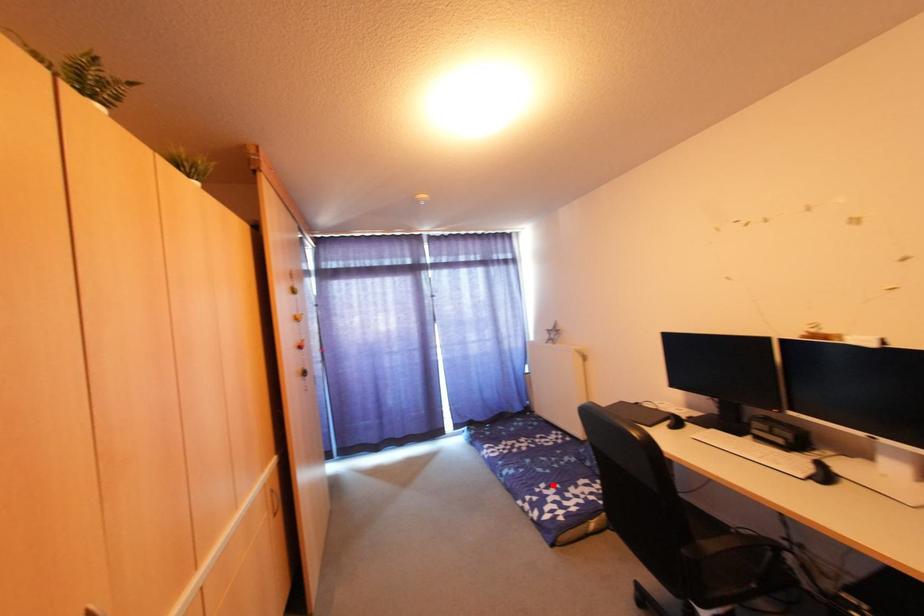
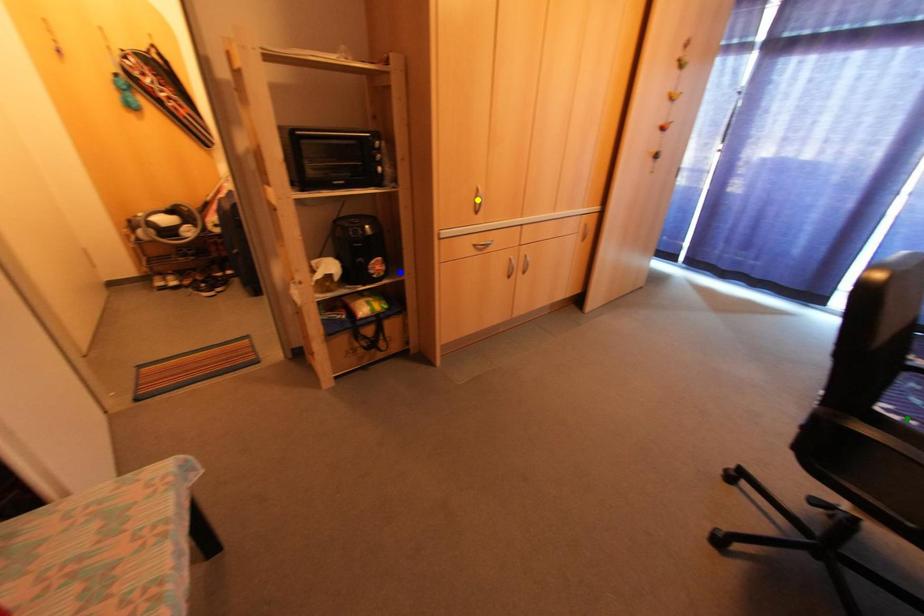
Question: I am providing you with two images of the same scene from different viewpoints. A red point is marked on the first image. You are given multiple points on the second image. Which point in image 2 is actually the same real-world point as the red point in image 1?

Choices:
 (A) yellow point
 (B) green point
 (C) blue point

Answer: (B)